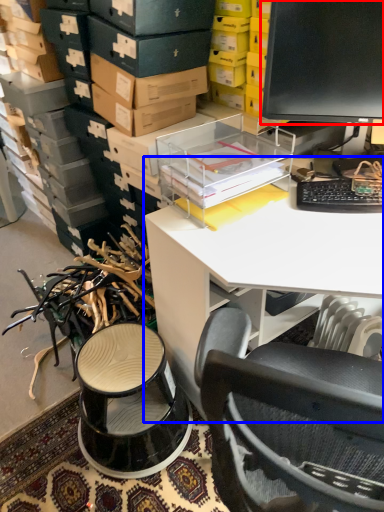
Question: Which object is closer to the camera taking this photo, computer monitor (highlighted by a red box) or desk (highlighted by a blue box)?

Choices:
 (A) computer monitor
 (B) desk

Answer: (B)